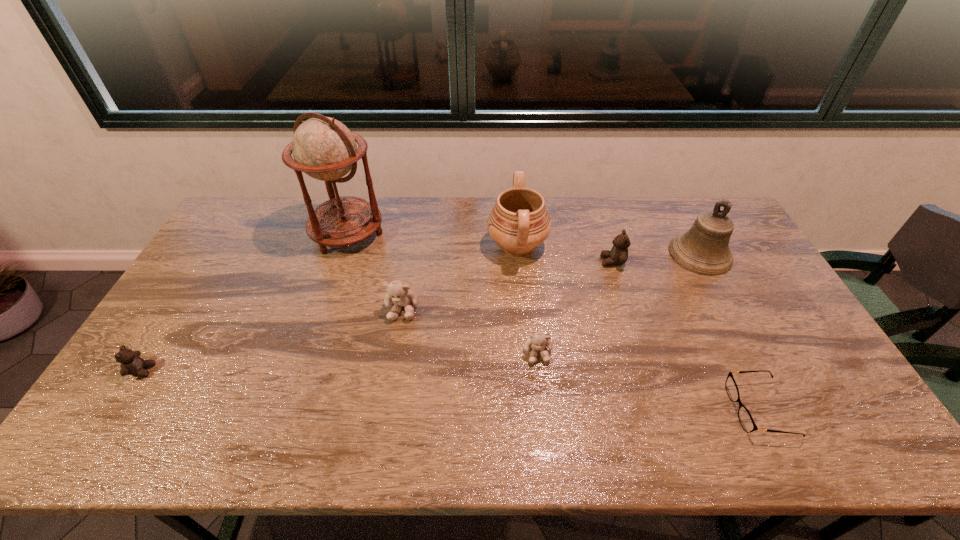
The height and width of the screenshot is (540, 960). Find the location of `free space between the spectacles and the third nearest teddy bear`. free space between the spectacles and the third nearest teddy bear is located at coordinates (581, 359).

In order to click on free space between the bell and the shortest object in this screenshot , I will do `click(730, 332)`.

The height and width of the screenshot is (540, 960). Identify the location of empty location between the third object from right to left and the shortest object. (686, 335).

Find the location of a particular element. The height and width of the screenshot is (540, 960). vacant point located between the bell and the right gray teddy bear is located at coordinates (619, 303).

The width and height of the screenshot is (960, 540). In order to click on vacant space in between the left gray teddy bear and the left brown teddy bear in this screenshot , I will do click(273, 339).

The height and width of the screenshot is (540, 960). I want to click on vacant space in between the nearer gray teddy bear and the nearer brown teddy bear, so click(340, 361).

Where is `free area in between the nearer brown teddy bear and the seventh object from right to left`? The width and height of the screenshot is (960, 540). free area in between the nearer brown teddy bear and the seventh object from right to left is located at coordinates (245, 302).

Locate an element on the screen. The height and width of the screenshot is (540, 960). object that can be found as the second closest to the second farthest teddy bear is located at coordinates (519, 222).

This screenshot has height=540, width=960. Find the location of `the seventh closest object to the shortest object`. the seventh closest object to the shortest object is located at coordinates (131, 363).

Image resolution: width=960 pixels, height=540 pixels. In order to click on teddy bear that stands as the second closest to the urn in this screenshot , I will do click(398, 293).